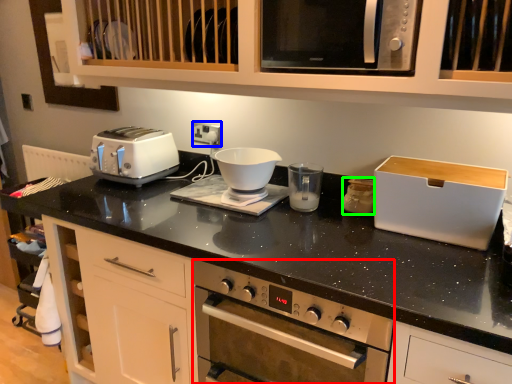
Question: Which is farther away from home appliance (highlighted by a red box)? electric outlet (highlighted by a blue box) or appliance (highlighted by a green box)?

Choices:
 (A) electric outlet
 (B) appliance

Answer: (A)